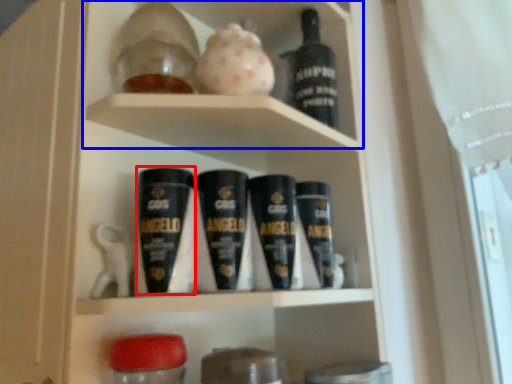
Question: Which of the following is the farthest to the observer, shaving cream (highlighted by a red box) or cabinet (highlighted by a blue box)?

Choices:
 (A) shaving cream
 (B) cabinet

Answer: (B)